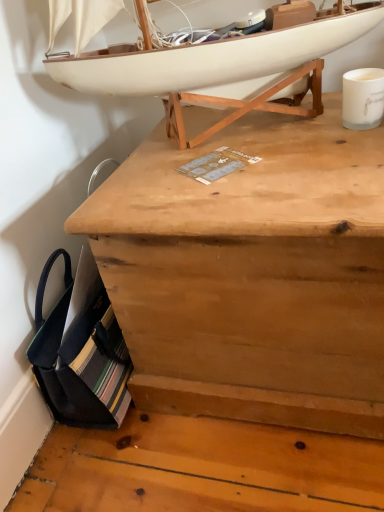
Locate an element on the screen. free space in front of white matte boat at upper center is located at coordinates (241, 185).